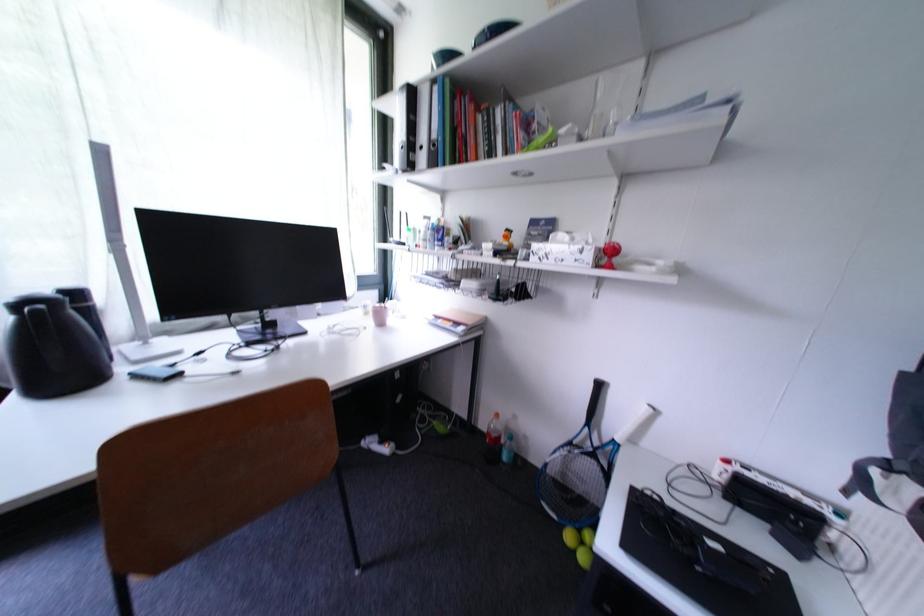
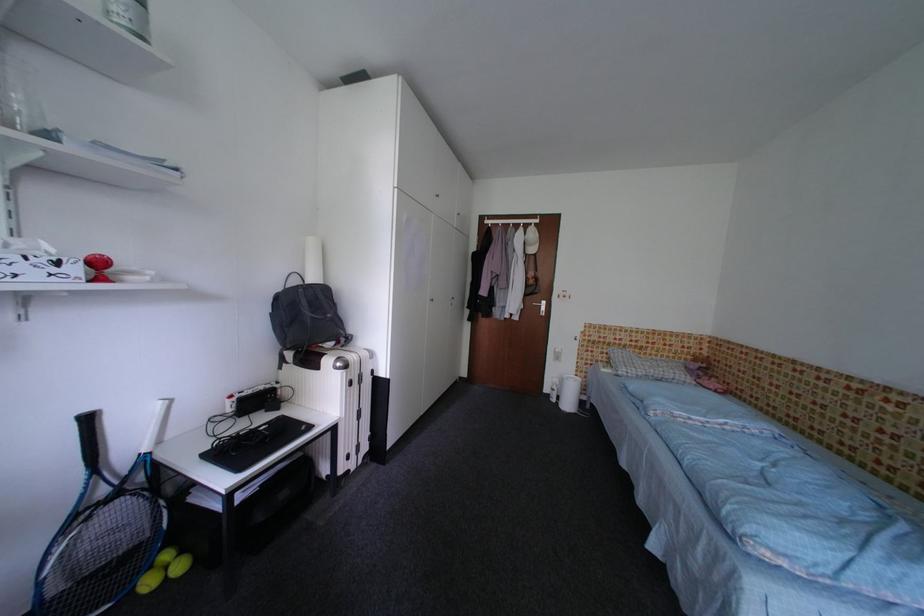
In the second image, find the point that corresponds to (x=759, y=538) in the first image.

(270, 421)